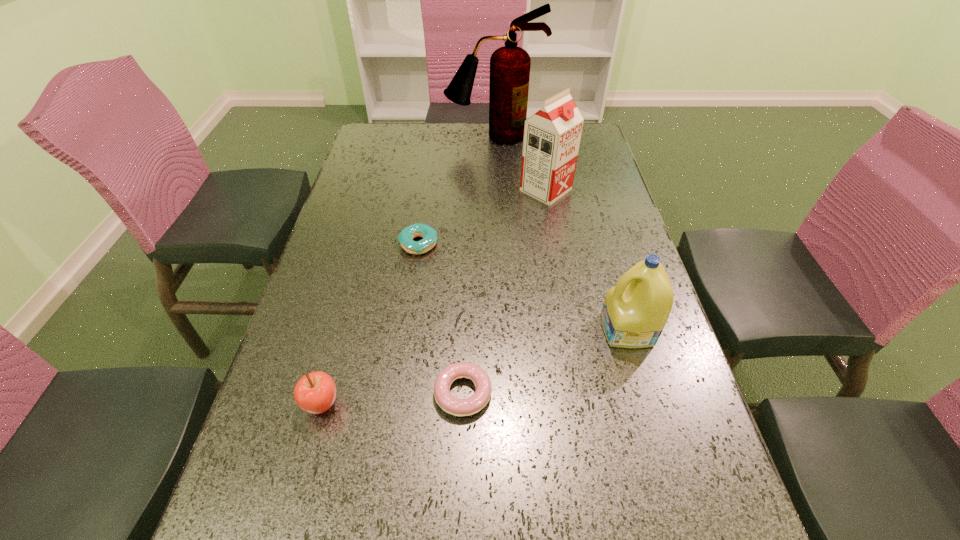
What are the coordinates of `the tallest object` in the screenshot? It's located at (510, 65).

Find the location of a particular element. fire extinguisher is located at coordinates (510, 65).

At what (x,y) coordinates should I click in order to perform the action: click on the fifth shortest object. Please return your answer as a coordinate pair (x, y). Image resolution: width=960 pixels, height=540 pixels. Looking at the image, I should click on (552, 135).

Identify the location of soya milk. The height and width of the screenshot is (540, 960). (552, 135).

At what (x,y) coordinates should I click in order to perform the action: click on the fourth farthest object. Please return your answer as a coordinate pair (x, y). The image size is (960, 540). Looking at the image, I should click on (635, 311).

Where is `the fourth shortest object`? The width and height of the screenshot is (960, 540). the fourth shortest object is located at coordinates (635, 311).

At what (x,y) coordinates should I click in order to perform the action: click on the fourth tallest object. Please return your answer as a coordinate pair (x, y). Image resolution: width=960 pixels, height=540 pixels. Looking at the image, I should click on (315, 392).

Where is `the leftmost object`? the leftmost object is located at coordinates (315, 392).

Locate an element on the screen. the farther doughnut is located at coordinates (429, 235).

Where is `the left doughnut`? The height and width of the screenshot is (540, 960). the left doughnut is located at coordinates (429, 235).